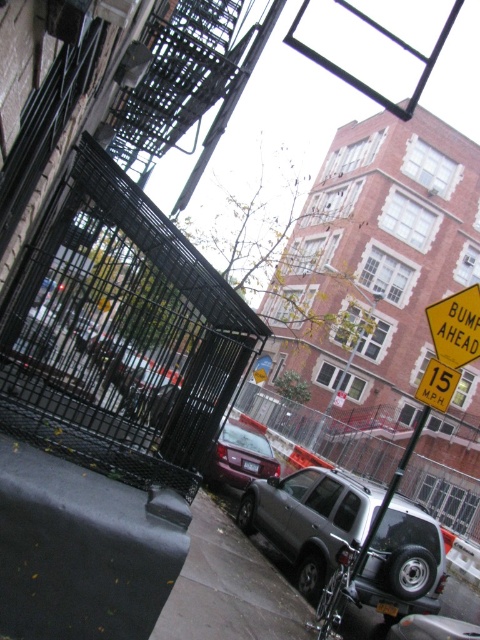
Question: Does yellow/yellowish paper bumper ahead at right have a lesser width compared to metallic pole at center?

Choices:
 (A) no
 (B) yes

Answer: (B)

Question: Which is nearer to the yellow plastic speed limit sign at upper right?

Choices:
 (A) yellow/yellowish paper bumper ahead at right
 (B) matte purple car at center

Answer: (A)

Question: Which is nearer to the satin silver suv at center?

Choices:
 (A) yellow plastic speed limit sign at upper right
 (B) metallic pole at center
 (C) matte purple car at center

Answer: (B)

Question: In this image, where is metallic pole at center located relative to yellow plastic speed limit sign at upper right?

Choices:
 (A) above
 (B) below

Answer: (B)

Question: Which of the following is the closest to the observer?

Choices:
 (A) matte purple car at center
 (B) yellow/yellowish paper bumper ahead at right
 (C) metallic pole at center

Answer: (C)

Question: Is metallic pole at center smaller than yellow plastic speed limit sign at upper right?

Choices:
 (A) yes
 (B) no

Answer: (B)